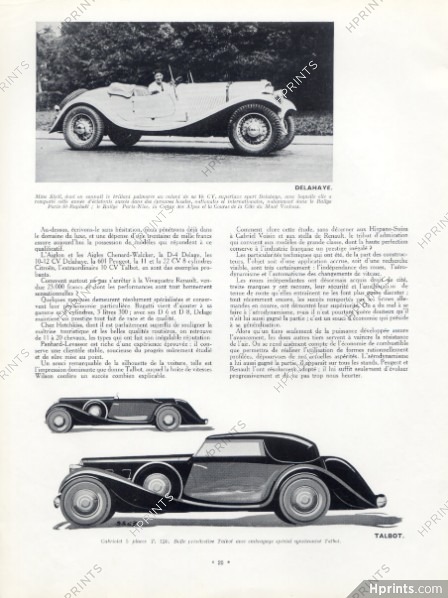
I want to click on window, so click(239, 451).